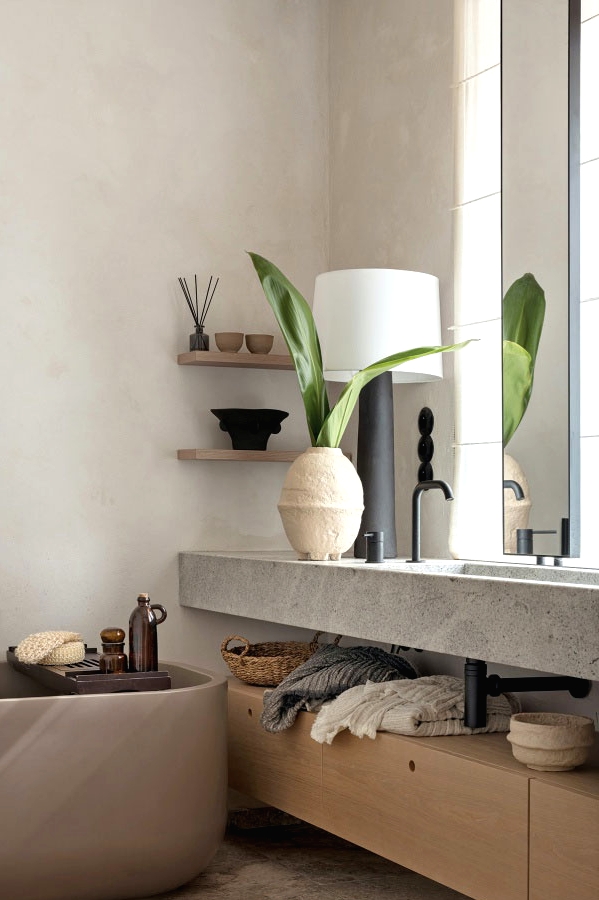
In order to click on floating shelves in this screenshot , I will do [214, 452], [211, 358].